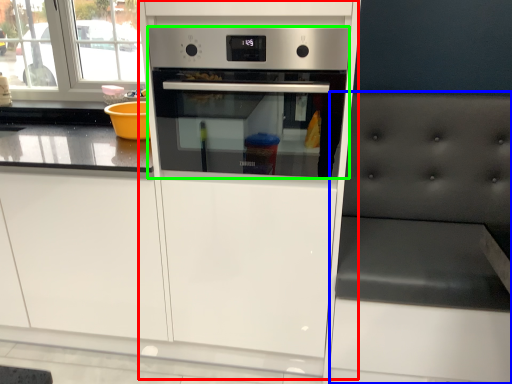
Question: Estimate the real-world distances between objects in this image. Which object is closer to fridge (highlighted by a red box), chair (highlighted by a blue box) or home appliance (highlighted by a green box)?

Choices:
 (A) chair
 (B) home appliance

Answer: (B)